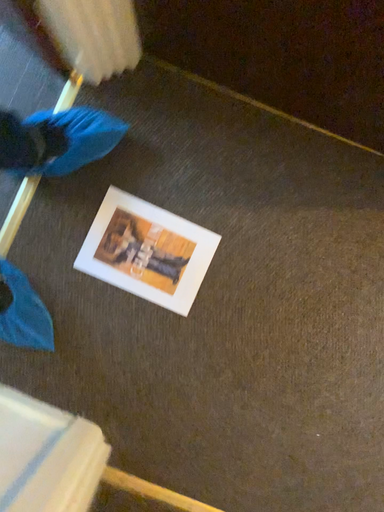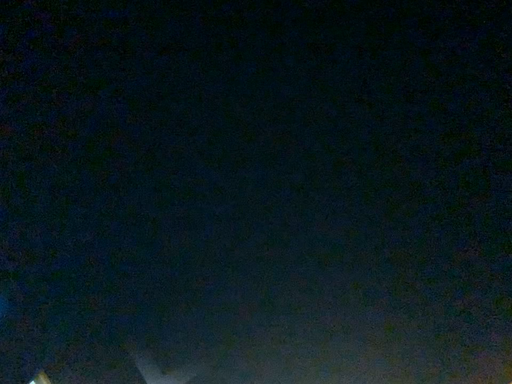
Question: How did the camera likely rotate when shooting the video?

Choices:
 (A) rotated upward
 (B) rotated downward

Answer: (A)